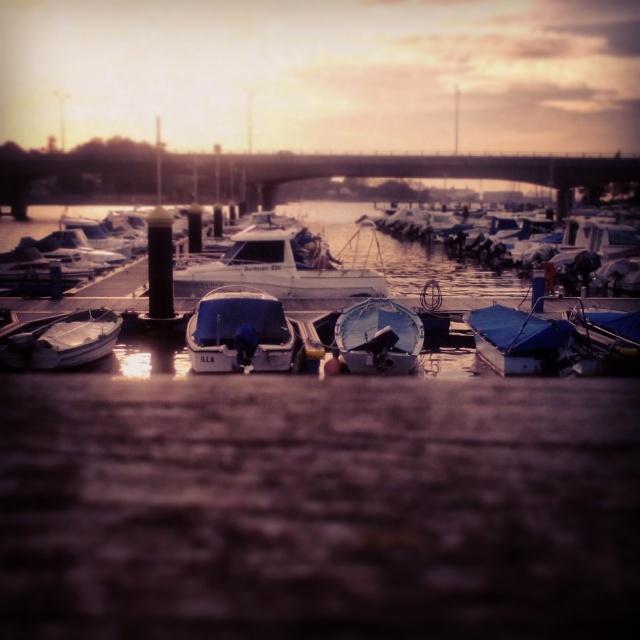
Is blue tarp-covered boat at center smaller than blue tarpaulin boat at center?

Incorrect, blue tarp-covered boat at center is not smaller in size than blue tarpaulin boat at center.

Does blue tarp-covered boat at center have a larger size compared to blue tarpaulin boat at center?

Indeed, blue tarp-covered boat at center has a larger size compared to blue tarpaulin boat at center.

Between point (252, 337) and point (504, 314), which one is positioned in front?

Point (252, 337) is in front.

Locate an element on the screen. blue tarp-covered boat at center is located at coordinates (241, 332).

Looking at this image, can you confirm if white matte boat at center is positioned above blue tarp-covered boat at center?

Yes, white matte boat at center is above blue tarp-covered boat at center.

Is white matte boat at center further to camera compared to blue tarp-covered boat at center?

Yes.

Does point (352, 289) lie in front of point (211, 324)?

No, it is not.

The width and height of the screenshot is (640, 640). Find the location of `white matte boat at center`. white matte boat at center is located at coordinates (285, 266).

Can you confirm if blue tarpaulin boat at center is wider than shiny blue tarpaulin boat at center?

Incorrect, blue tarpaulin boat at center's width does not surpass shiny blue tarpaulin boat at center's.

Measure the distance between point (x=522, y=349) and camera.

Point (x=522, y=349) and camera are 16.31 meters apart.

Is point (499, 330) positioned after point (394, 326)?

Yes, point (499, 330) is behind point (394, 326).

You are a GUI agent. You are given a task and a screenshot of the screen. Output one action in this format:
    pyautogui.click(x=<x>, y=<y>)
    Task: Click on the blue tarpaulin boat at center
    This screenshot has height=640, width=640.
    Given the screenshot: What is the action you would take?
    pyautogui.click(x=522, y=340)